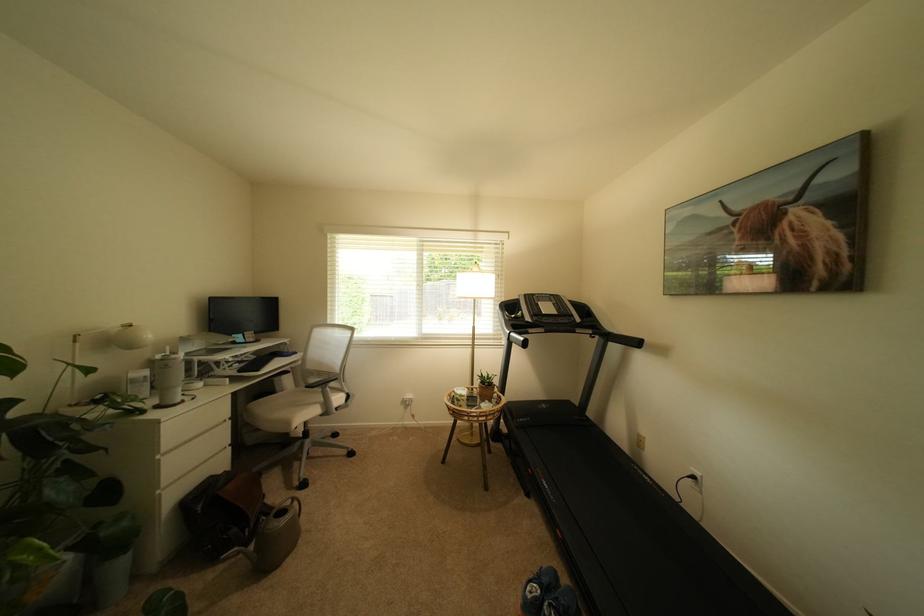
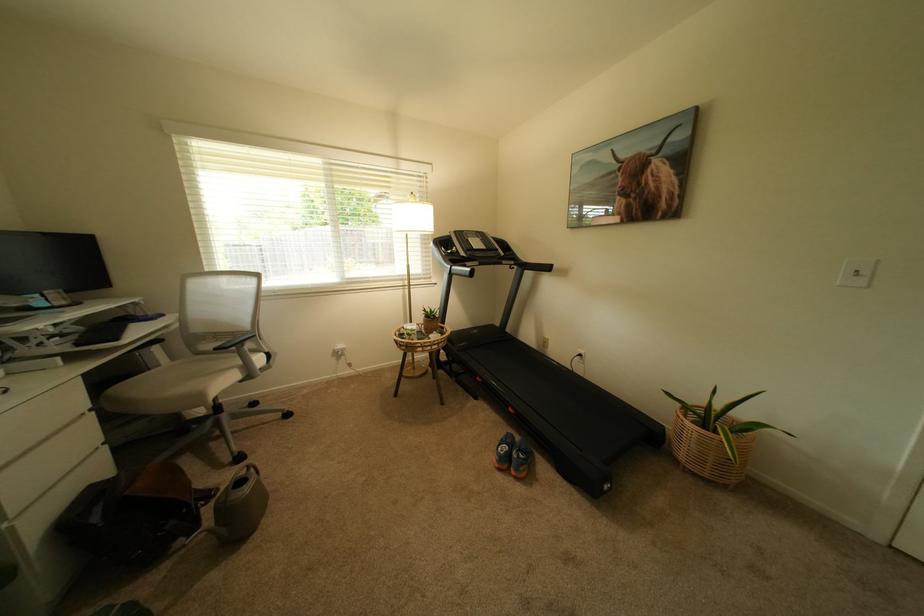
Locate, in the second image, the point that corresponds to point 565,314 in the first image.

(493, 249)